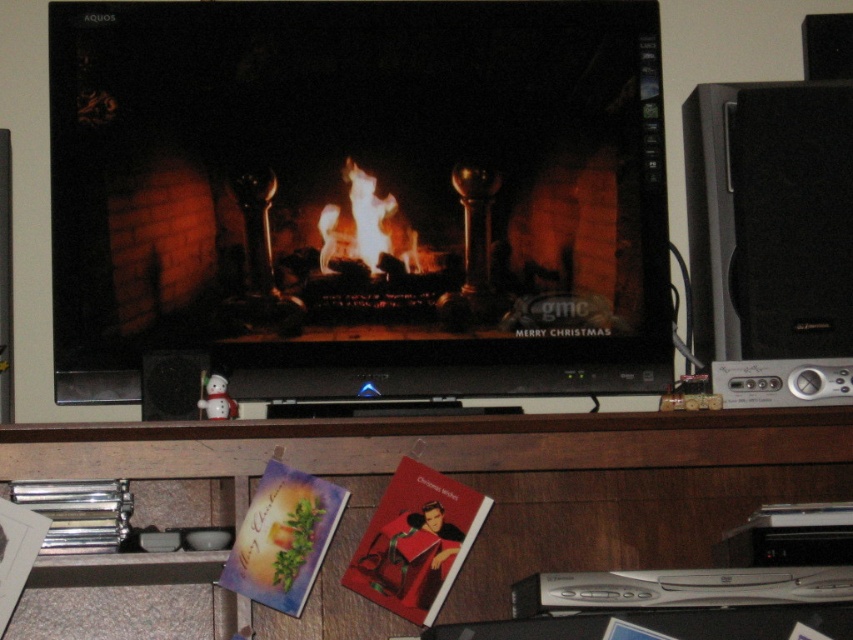
Question: Which object is the farthest from the flamematerial/texture at center?

Choices:
 (A) wooden entertainment center at lower center
 (B) matte black fireplace at center

Answer: (A)

Question: Which of the following is the closest to the observer?

Choices:
 (A) flamematerial/texture at center
 (B) wooden entertainment center at lower center

Answer: (B)

Question: Is wooden entertainment center at lower center bigger than flamematerial/texture at center?

Choices:
 (A) yes
 (B) no

Answer: (A)

Question: In this image, where is wooden entertainment center at lower center located relative to flamematerial/texture at center?

Choices:
 (A) left
 (B) right

Answer: (B)

Question: Which point is farther to the camera?

Choices:
 (A) matte black fireplace at center
 (B) wooden entertainment center at lower center
 (C) flamematerial/texture at center

Answer: (C)

Question: Does matte black fireplace at center appear on the left side of wooden entertainment center at lower center?

Choices:
 (A) yes
 (B) no

Answer: (A)